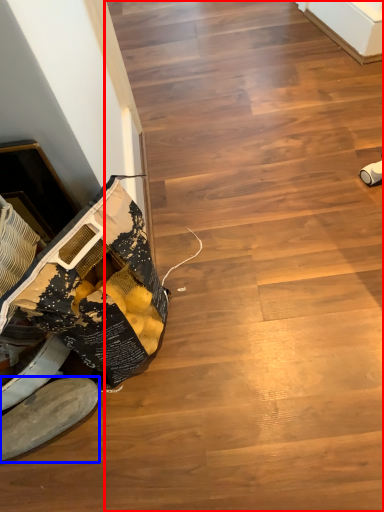
Question: Among these objects, which one is nearest to the camera, stairwell (highlighted by a red box) or footwear (highlighted by a blue box)?

Choices:
 (A) stairwell
 (B) footwear

Answer: (A)